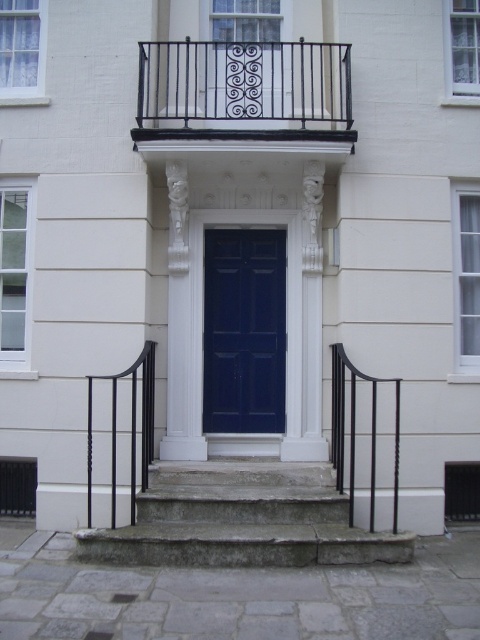
Which is behind, point (266, 124) or point (135, 428)?

Positioned behind is point (266, 124).

Who is lower down, black wrought iron balcony at upper center or black wrought iron railing at lower left?

Positioned lower is black wrought iron railing at lower left.

Image resolution: width=480 pixels, height=640 pixels. Describe the element at coordinates (243, 92) in the screenshot. I see `black wrought iron balcony at upper center` at that location.

Where is `black wrought iron balcony at upper center`? black wrought iron balcony at upper center is located at coordinates (243, 92).

Does point (158, 518) lie behind point (265, 387)?

No, it is not.

Does stone steps at center come in front of matte blue door at center?

Yes, stone steps at center is closer to the viewer.

Is point (262, 499) positioned behind point (245, 312)?

No, (262, 499) is closer to viewer.

The width and height of the screenshot is (480, 640). I want to click on stone steps at center, so click(x=241, y=518).

Does black wrought iron railing at lower left have a lesser width compared to black wrought iron railing at right?

Yes, black wrought iron railing at lower left is thinner than black wrought iron railing at right.

Between point (144, 360) and point (352, 445), which one is positioned in front?

Point (352, 445) is in front.

I want to click on black wrought iron railing at lower left, so click(131, 428).